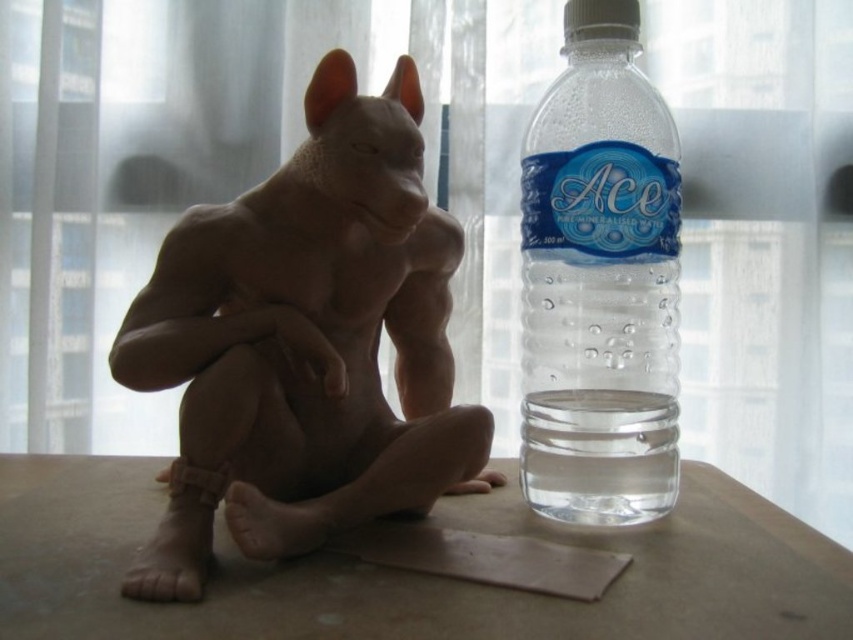
You are a delivery robot with a package that needs to be placed between the matte brown statue at center and the clear plastic bottle at right. The package is 3.5 inches wide. Can the package fit in the space between them?

The distance between the matte brown statue at center and the clear plastic bottle at right is 3.58 inches. Since the package is 3.5 inches wide, it can fit in the space between them as there is enough room.

You are a delivery robot that needs to place a new item on the table. The item is 5 inches wide. Can you safely place it between the matte brown table at lower center and the clear plastic bottle at right without touching either?

The distance between the matte brown table at lower center and the clear plastic bottle at right is 4.97 inches, which is slightly less than the item width of 5 inches. Therefore, placing the item there may cause it to touch one or both objects.

You are arranging items on a table and need to know the vertical position of the matte brown statue at center and clear plastic bottle at right. Which one is placed lower on the table?

The matte brown statue at center is located below the clear plastic bottle at right, so it is placed lower on the table.